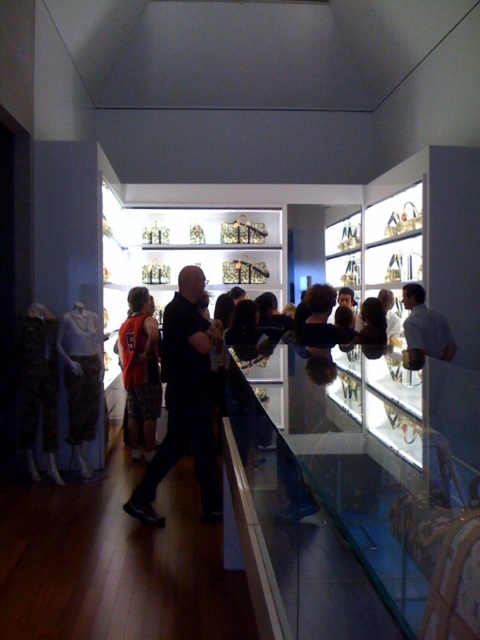
Who is more forward, (335, 454) or (49, 390)?

Point (335, 454)

Can you confirm if transparent glass case at center is taller than camouflage fabric pants at left?

No, transparent glass case at center is not taller than camouflage fabric pants at left.

Who is more distant from viewer, (x=397, y=588) or (x=34, y=332)?

Point (x=34, y=332)

The image size is (480, 640). Identify the location of transparent glass case at center. (346, 520).

Is black matte shirt at center thinner than camouflage pants at left?

No.

Is point (193, 376) closer to viewer compared to point (97, 412)?

Yes, it is.

Does point (201, 404) come in front of point (78, 316)?

That is True.

The height and width of the screenshot is (640, 480). In order to click on black matte shirt at center in this screenshot , I will do [x=183, y=401].

Measure the distance between camouflage fabric pants at left and white matte shirt at center.

camouflage fabric pants at left is 3.22 meters from white matte shirt at center.

Is camouflage fabric pants at left shorter than white matte shirt at center?

No, camouflage fabric pants at left is not shorter than white matte shirt at center.

Is point (52, 440) less distant than point (445, 352)?

Yes, point (52, 440) is closer to viewer.

Where is `camouflage fabric pants at left`? The width and height of the screenshot is (480, 640). camouflage fabric pants at left is located at coordinates (37, 387).